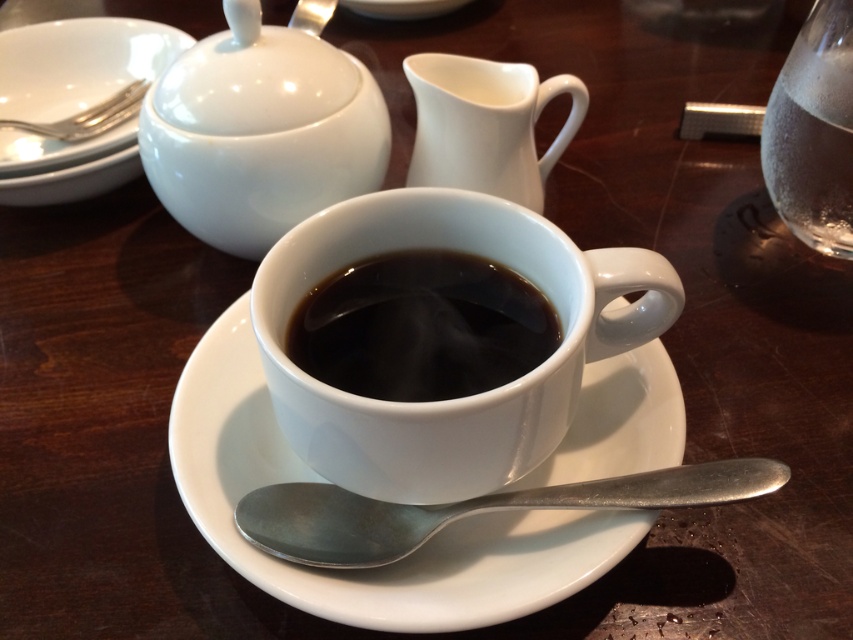
You are setting up a tea party and need to place a small candy on the table. You want to put it on the object that is bigger between the white glossy sugar bowl at upper left and the silver metallic spoon at lower center. Which object should you choose?

The white glossy sugar bowl at upper left is larger than the silver metallic spoon at lower center, so you should place the candy on the white glossy sugar bowl at upper left.

You are setting up a table for a guest and need to place a coffee cup on the white ceramic saucer at center. According to the image, where exactly should you position the cup on the saucer?

The white ceramic saucer at center is located at point coordinates of (380, 566). Position the cup precisely at this point to ensure proper placement.

You are holding a small toy that is 12 inches long and want to place it on the table in front of the white ceramic cup at center. Can the toy fit entirely in front of the cup without overlapping it?

The distance between the white ceramic cup at center and the viewer is 14.53 inches. Since the toy is 12 inches long, it can fit entirely in front of the cup without overlapping it as there is enough space between the cup and the viewer.